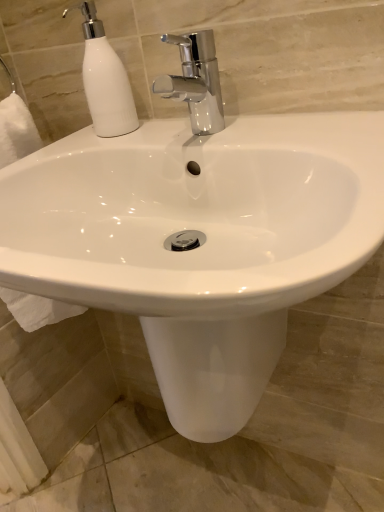
What are the coordinates of `vacant space that is to the left of chrome metallic faucet at upper center` in the screenshot? It's located at (115, 139).